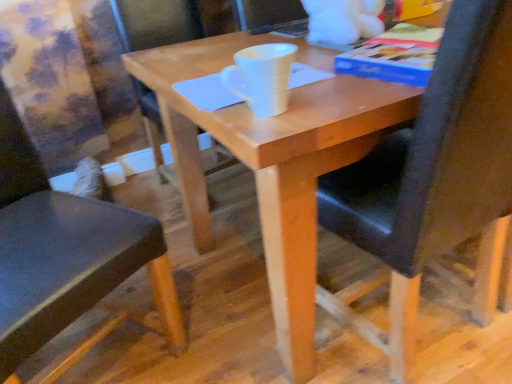
Locate an element on the screen. The image size is (512, 384). free point below black leather chair at left, the 2th chair when ordered from right to left (from a real-world perspective) is located at coordinates (x=106, y=350).